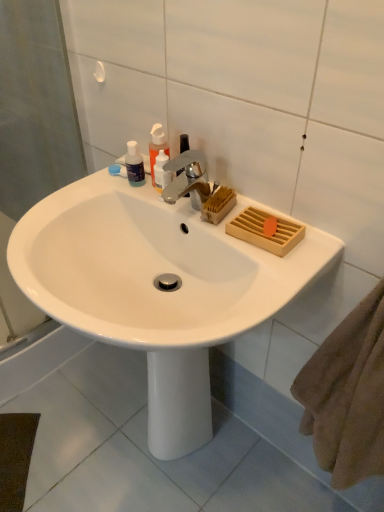
Question: Do you think translucent plastic bottles at upper left, which ranks as the second toiletry in left-to-right order, is within translucent plastic soap dispenser at upper center, or outside of it?

Choices:
 (A) inside
 (B) outside

Answer: (B)

Question: From a real-world perspective, is translucent plastic bottles at upper left, which ranks as the second toiletry in left-to-right order, physically located above or below translucent plastic soap dispenser at upper center?

Choices:
 (A) below
 (B) above

Answer: (A)

Question: Which object is positioned farthest from the translucent plastic soap dispenser at upper center?

Choices:
 (A) translucent plastic bottles at upper left, the first toiletry when ordered from right to left
 (B) white glossy sink at center
 (C) translucent plastic bottle at upper left, the 2th toiletry from the right

Answer: (B)

Question: Based on their relative distances, which object is nearer to the translucent plastic soap dispenser at upper center?

Choices:
 (A) translucent plastic bottle at upper left, the 1th toiletry viewed from the left
 (B) white glossy sink at center
 (C) translucent plastic bottles at upper left, the first toiletry when ordered from right to left

Answer: (C)